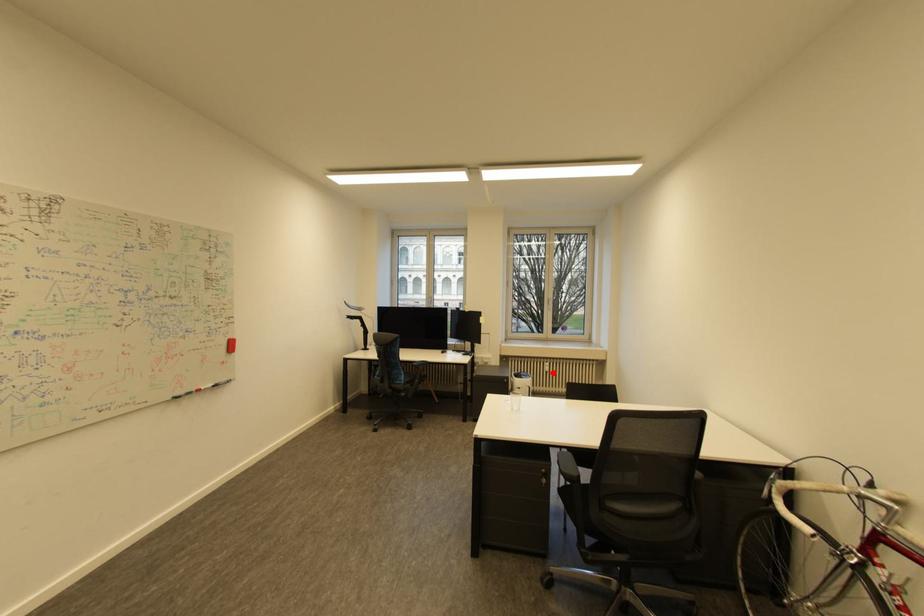
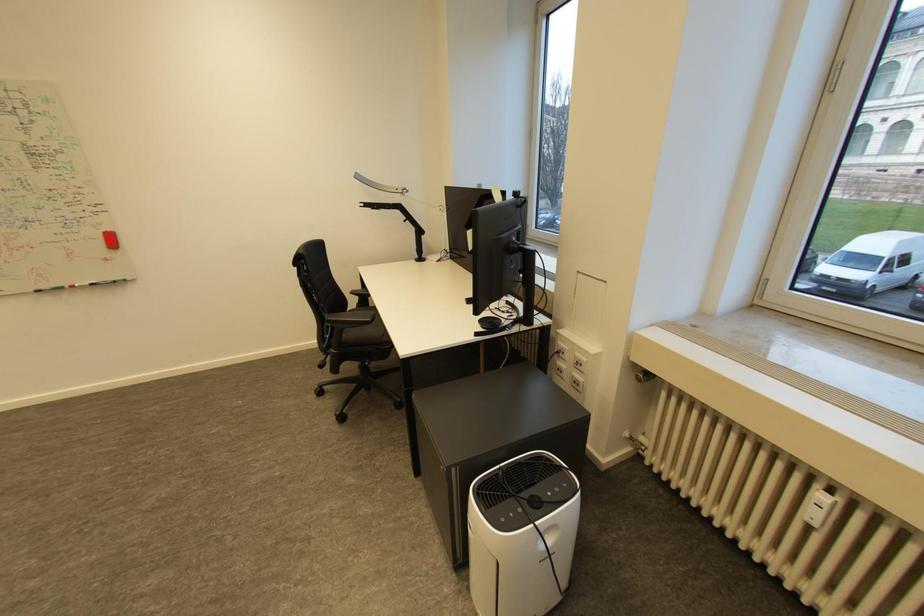
I am providing you with two images of the same scene from different viewpoints. A red point is marked on the first image and another point is marked on the second image. Are the points marked in image1 and image2 representing the same 3D position?

No